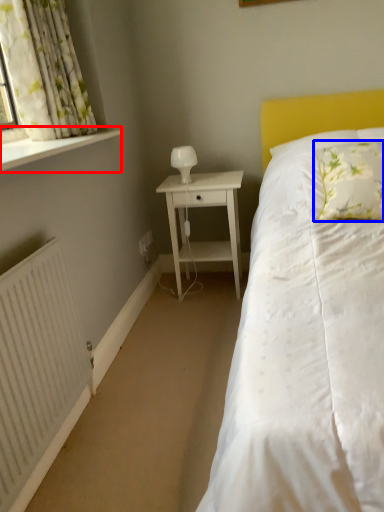
Question: Which of the following is the farthest to the observer, window sill (highlighted by a red box) or pillow (highlighted by a blue box)?

Choices:
 (A) window sill
 (B) pillow

Answer: (B)